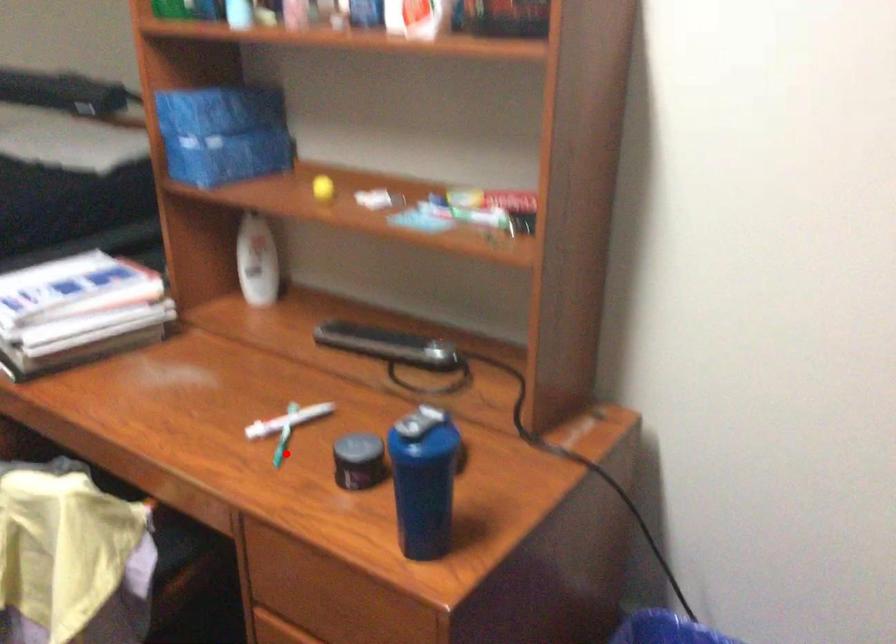
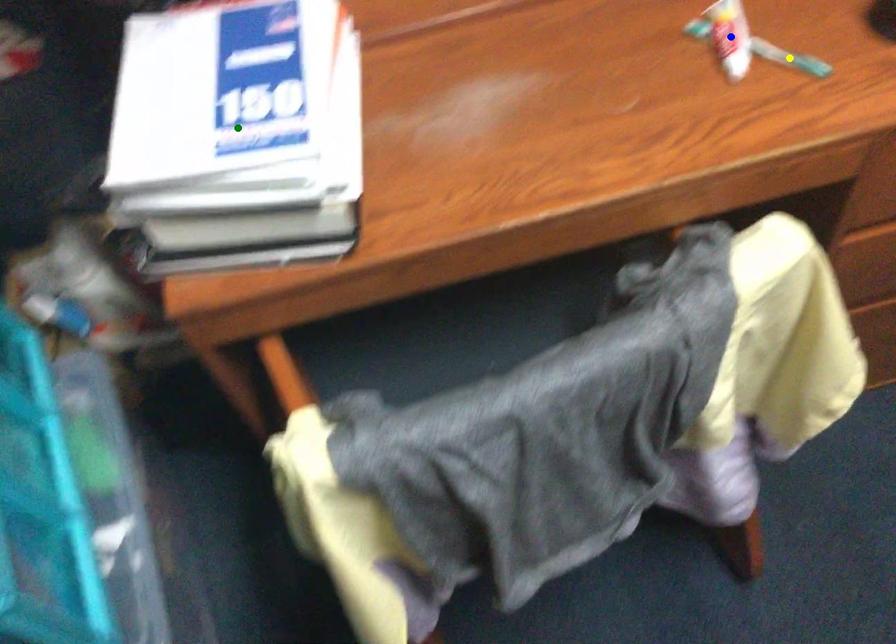
Question: I am providing you with two images of the same scene from different viewpoints. A red point is marked on the first image. You are given multiple points on the second image. Which point in image 2 is actually the same real-world point as the red point in image 1?

Choices:
 (A) green point
 (B) blue point
 (C) yellow point

Answer: (C)